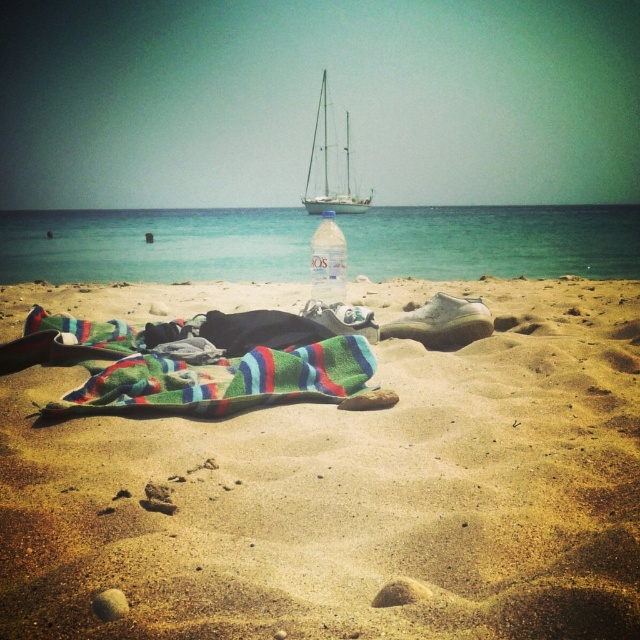
Does point (65, 604) come in front of point (200, 410)?

That is True.

Does smooth golden sand at center appear on the right side of striped cotton towel at center?

Correct, you'll find smooth golden sand at center to the right of striped cotton towel at center.

At what (x,y) coordinates should I click in order to perform the action: click on smooth golden sand at center. Please return your answer as a coordinate pair (x, y). Looking at the image, I should click on (349, 493).

Between point (428, 442) and point (312, 285), which one is positioned behind?

Positioned behind is point (312, 285).

Is point (541, 307) more distant than point (312, 266)?

Yes, it is.

Image resolution: width=640 pixels, height=640 pixels. Identify the location of smooth golden sand at center. (349, 493).

In order to click on smooth golden sand at center in this screenshot , I will do pos(349,493).

Who is shorter, striped cotton towel at center or white matte sailboat at center?

striped cotton towel at center

Does striped cotton towel at center lie in front of white matte sailboat at center?

Yes, striped cotton towel at center is in front of white matte sailboat at center.

What do you see at coordinates (195, 362) in the screenshot? The height and width of the screenshot is (640, 640). I see `striped cotton towel at center` at bounding box center [195, 362].

You are a GUI agent. You are given a task and a screenshot of the screen. Output one action in this format:
    pyautogui.click(x=<x>, y=<y>)
    Task: Click on the striped cotton towel at center
    Image resolution: width=640 pixels, height=640 pixels.
    Given the screenshot: What is the action you would take?
    pyautogui.click(x=195, y=362)